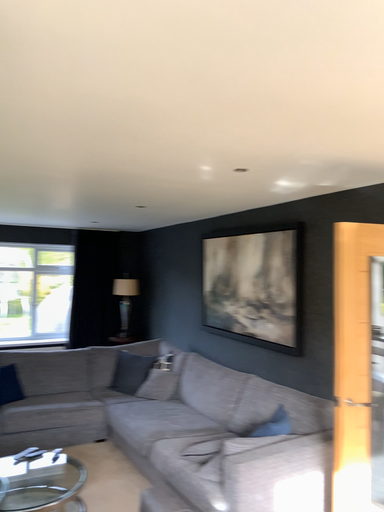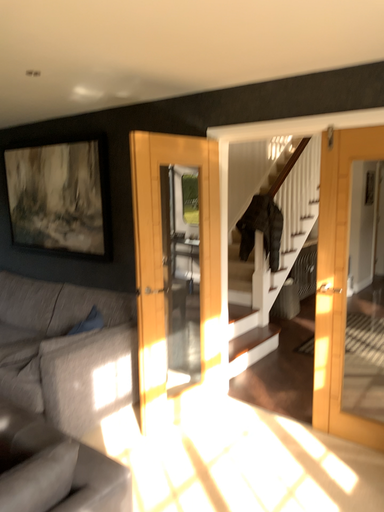
Question: How did the camera likely rotate when shooting the video?

Choices:
 (A) rotated downward
 (B) rotated upward

Answer: (A)